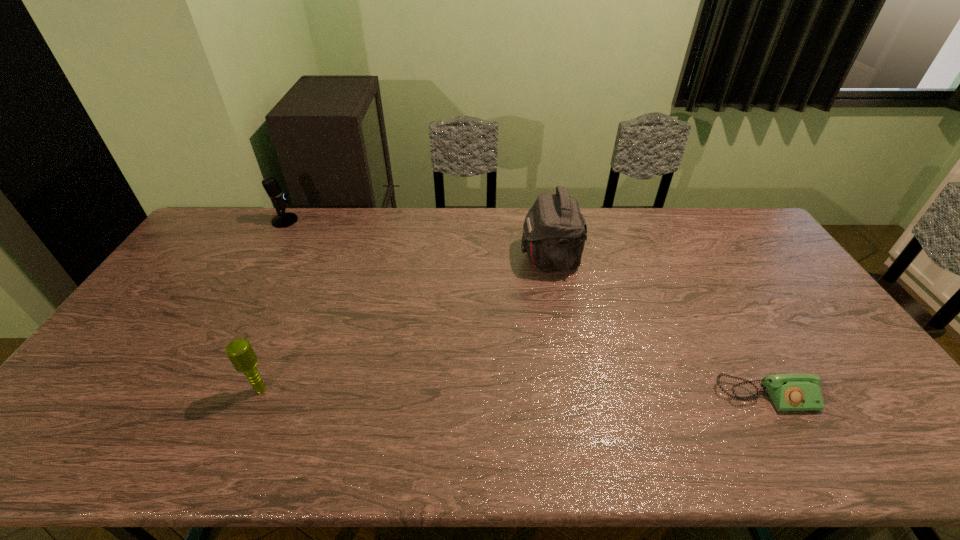
Locate an element on the screen. the tallest object is located at coordinates (554, 231).

Identify the location of the second object from right to left. (554, 231).

At what (x,y) coordinates should I click in order to perform the action: click on the leftmost object. Please return your answer as a coordinate pair (x, y). This screenshot has height=540, width=960. Looking at the image, I should click on [x=283, y=219].

Identify the location of the left microphone. The width and height of the screenshot is (960, 540). (283, 219).

Identify the location of the right microphone. (240, 352).

Image resolution: width=960 pixels, height=540 pixels. I want to click on the nearer microphone, so click(240, 352).

Locate an element on the screen. the rightmost object is located at coordinates (789, 392).

This screenshot has width=960, height=540. Identify the location of the shortest object. (789, 392).

Where is `vacant point located on the open flap of the second farthest object`? vacant point located on the open flap of the second farthest object is located at coordinates (432, 258).

You are a GUI agent. You are given a task and a screenshot of the screen. Output one action in this format:
    pyautogui.click(x=<x>, y=<y>)
    Task: Click on the free space located on the open flap of the second farthest object
    The image size is (960, 540).
    Given the screenshot: What is the action you would take?
    pyautogui.click(x=438, y=258)